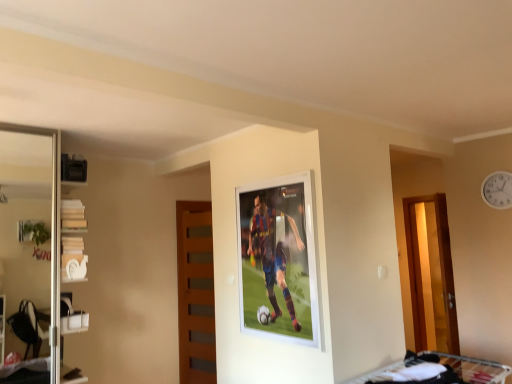
The width and height of the screenshot is (512, 384). What do you see at coordinates (447, 369) in the screenshot?
I see `white fabric bunk bed at lower right` at bounding box center [447, 369].

This screenshot has height=384, width=512. Identify the location of wooden at center. (195, 293).

Image resolution: width=512 pixels, height=384 pixels. Describe the element at coordinates (195, 293) in the screenshot. I see `wooden at center` at that location.

Describe the element at coordinates (32, 218) in the screenshot. I see `transparent glass screen door at left` at that location.

Identify the location of white plastic clock at upper right. (497, 190).

I want to click on white fabric bunk bed at lower right, so 447,369.

Would you say white fabric bunk bed at lower right contains white glossy shelves at left?

No, white glossy shelves at left is not a part of white fabric bunk bed at lower right.

In terms of width, does white fabric bunk bed at lower right look wider or thinner when compared to white glossy shelves at left?

In the image, white fabric bunk bed at lower right appears to be wider than white glossy shelves at left.

Locate an element on the screen. bunk bed below the white glossy shelves at left (from the image's perspective) is located at coordinates (447, 369).

Consider the image. Which object is wider, white fabric bunk bed at lower right or white plastic clock at upper right?

With larger width is white fabric bunk bed at lower right.

Would you say white fabric bunk bed at lower right is to the left or to the right of white plastic clock at upper right in the picture?

white fabric bunk bed at lower right is to the left of white plastic clock at upper right.

In the scene shown: From the image's perspective, would you say white fabric bunk bed at lower right is shown under white plastic clock at upper right?

Indeed, from the image's perspective, white fabric bunk bed at lower right is shown beneath white plastic clock at upper right.

Does point (458, 370) come in front of point (493, 175)?

That is True.

Where is `screen door in front of the white glossy shelves at left`? The height and width of the screenshot is (384, 512). screen door in front of the white glossy shelves at left is located at coordinates (32, 218).

From a real-world perspective, which object rests below the other?

In real-world perspective, white glossy shelves at left is lower.

How far apart are transparent glass screen door at left and white glossy shelves at left?

The distance of transparent glass screen door at left from white glossy shelves at left is 4.25 feet.

From the image's perspective, does white glossy shelves at left appear higher than wooden at center?

Yes, from the image's perspective, white glossy shelves at left is above wooden at center.

Is wooden at center at the back of white glossy shelves at left?

No, white glossy shelves at left's orientation is not away from wooden at center.

Which of these two, white glossy shelves at left or wooden at center, is bigger?

Bigger between the two is white glossy shelves at left.

Is point (81, 312) less distant than point (177, 250)?

Yes, it is.

Who is bigger, white fabric bunk bed at lower right or transparent glass screen door at left?

With larger size is transparent glass screen door at left.

Considering the sizes of objects white fabric bunk bed at lower right and transparent glass screen door at left in the image provided, who is thinner, white fabric bunk bed at lower right or transparent glass screen door at left?

transparent glass screen door at left.

From the image's perspective, is white fabric bunk bed at lower right on transparent glass screen door at left?

No, from the image's perspective, white fabric bunk bed at lower right is not over transparent glass screen door at left.

Could you tell me if white fabric bunk bed at lower right is turned towards transparent glass screen door at left?

No, white fabric bunk bed at lower right does not turn towards transparent glass screen door at left.

Measure the distance from wooden at center to white fabric bunk bed at lower right.

They are 2.04 meters apart.

Is wooden at center taller or shorter than white fabric bunk bed at lower right?

In the image, wooden at center appears to be taller than white fabric bunk bed at lower right.

Does point (211, 223) come closer to viewer compared to point (509, 367)?

No, (211, 223) is further to viewer.

Where is `door that appears behind the white fabric bunk bed at lower right`? door that appears behind the white fabric bunk bed at lower right is located at coordinates (195, 293).

Image resolution: width=512 pixels, height=384 pixels. I want to click on screen door located on the left of white plastic clock at upper right, so click(x=32, y=218).

Which of these two, white plastic clock at upper right or transparent glass screen door at left, is wider?

Wider between the two is transparent glass screen door at left.

Can you confirm if white plastic clock at upper right is positioned to the left of transparent glass screen door at left?

No, white plastic clock at upper right is not to the left of transparent glass screen door at left.

The width and height of the screenshot is (512, 384). I want to click on shelf that is behind the white fabric bunk bed at lower right, so click(73, 241).

Identify the location of clock above the white fabric bunk bed at lower right (from a real-world perspective). (497, 190).

Looking at the image, which one is located further to transparent glass screen door at left, white plastic clock at upper right or white glossy shelves at left?

white plastic clock at upper right is positioned further to the anchor transparent glass screen door at left.

In the scene shown: Considering their positions, is white fabric bunk bed at lower right positioned closer to white plastic clock at upper right than transparent glass screen door at left?

white fabric bunk bed at lower right.

When comparing their distances from transparent glass screen door at left, does wooden at center or white fabric bunk bed at lower right seem further?

white fabric bunk bed at lower right.

Based on their spatial positions, is wooden at center or transparent glass screen door at left further from white fabric bunk bed at lower right?

transparent glass screen door at left is further to white fabric bunk bed at lower right.

From the image, which object appears to be farther from white glossy shelves at left, white plastic clock at upper right or wooden at center?

The object further to white glossy shelves at left is white plastic clock at upper right.

Which object lies further to the anchor point white fabric bunk bed at lower right, white plastic clock at upper right or white glossy shelves at left?

white glossy shelves at left lies further to white fabric bunk bed at lower right than the other object.

When comparing their distances from wooden at center, does white glossy shelves at left or white fabric bunk bed at lower right seem further?

The object further to wooden at center is white fabric bunk bed at lower right.

Based on their spatial positions, is transparent glass screen door at left or wooden at center further from white plastic clock at upper right?

transparent glass screen door at left is positioned further to the anchor white plastic clock at upper right.

Find the location of a particular element. This screenshot has height=384, width=512. shelf situated between transparent glass screen door at left and white plastic clock at upper right from left to right is located at coordinates (73, 241).

This screenshot has width=512, height=384. I want to click on door located between white glossy shelves at left and white plastic clock at upper right in the left-right direction, so click(x=195, y=293).

Locate an element on the screen. The image size is (512, 384). shelf between transparent glass screen door at left and wooden at center along the z-axis is located at coordinates (73, 241).

Where is `door between transparent glass screen door at left and white plastic clock at upper right in the horizontal direction`? This screenshot has width=512, height=384. door between transparent glass screen door at left and white plastic clock at upper right in the horizontal direction is located at coordinates (195, 293).